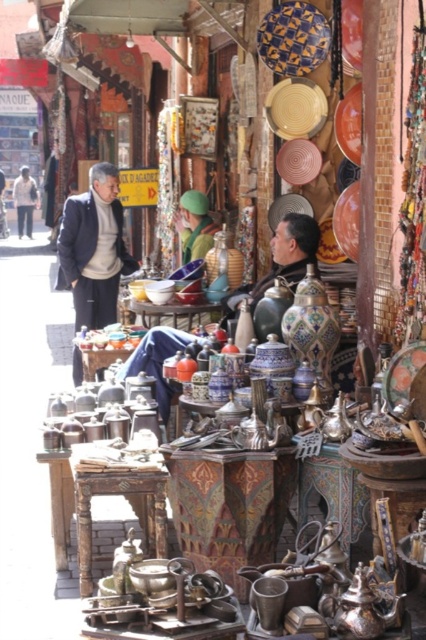
You are a customer at the market and want to buy both the matte brown leather jacket at center and the white cotton jacket at left. Which jacket is located lower in the display?

The matte brown leather jacket at center is positioned under the white cotton jacket at left, so it is located lower in the display.

You are a customer in the market and want to buy a jacket. You see the matte brown leather jacket at center and the white cotton jacket at left. Which jacket is wider?

The matte brown leather jacket at center is wider than the white cotton jacket at left.

You are standing in front of the market stall and want to place a new item exactly at the center of the stall. The stall is represented as a coordinate system where the bottom left corner is the origin point. The coordinates of the matte brown leather jacket at center are given. Can you determine if the jacket is already positioned at the center of the stall?

The coordinates of the matte brown leather jacket at center are at point (x=281, y=260). Since the center of the stall would be at coordinates (x=213, y=320), the jacket is slightly to the left and above the true center of the stall.